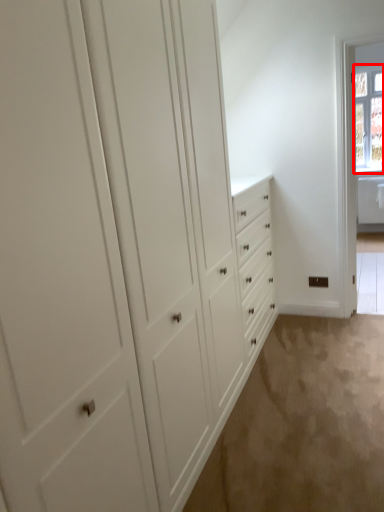
Question: From the image's perspective, where is window (annotated by the red box) located relative to plain?

Choices:
 (A) above
 (B) below

Answer: (A)